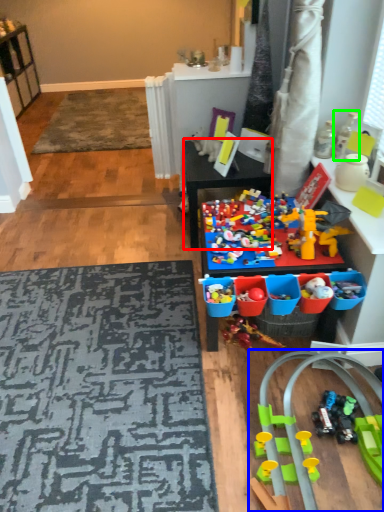
Question: Which object is positioned farthest from table (highlighted by a red box)? Select from toy (highlighted by a blue box) and toy (highlighted by a green box).

Choices:
 (A) toy
 (B) toy

Answer: (A)